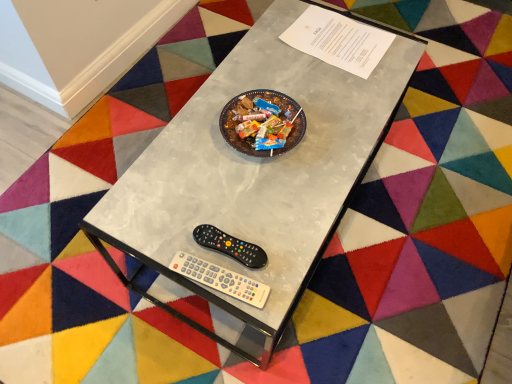
Where is `empty space that is to the right of black plastic remote at lower center`? This screenshot has height=384, width=512. empty space that is to the right of black plastic remote at lower center is located at coordinates (287, 235).